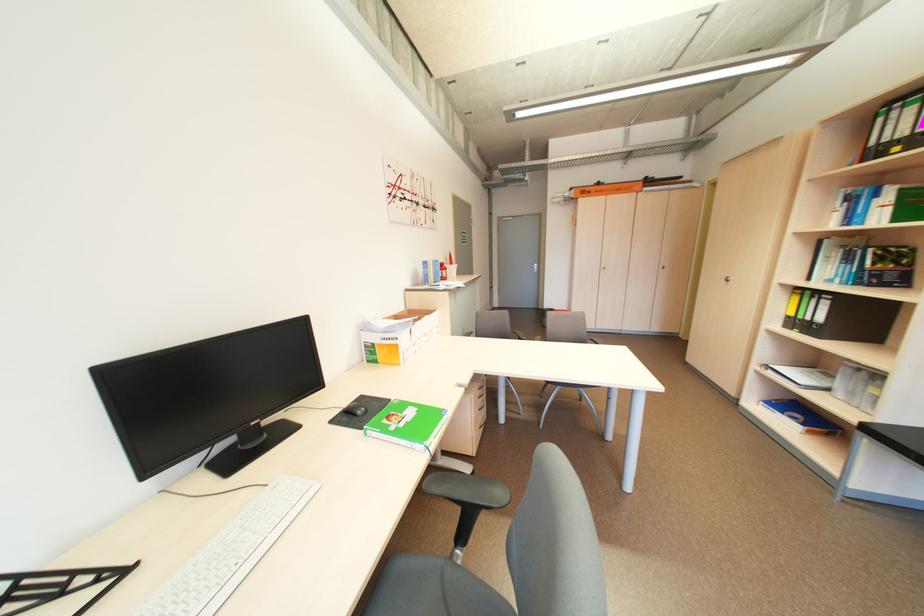
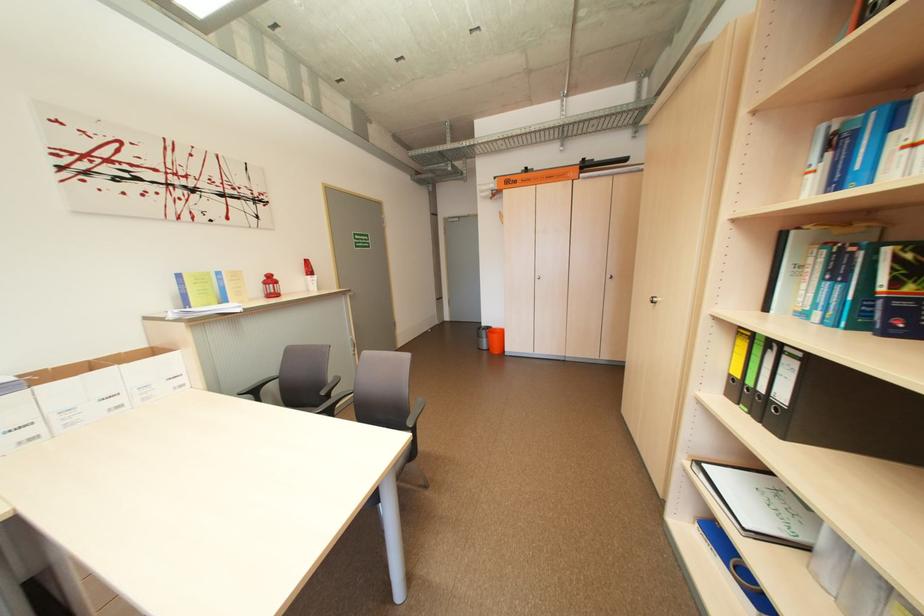
Locate, in the second image, the point that corresponds to [797,318] in the first image.

(743, 379)